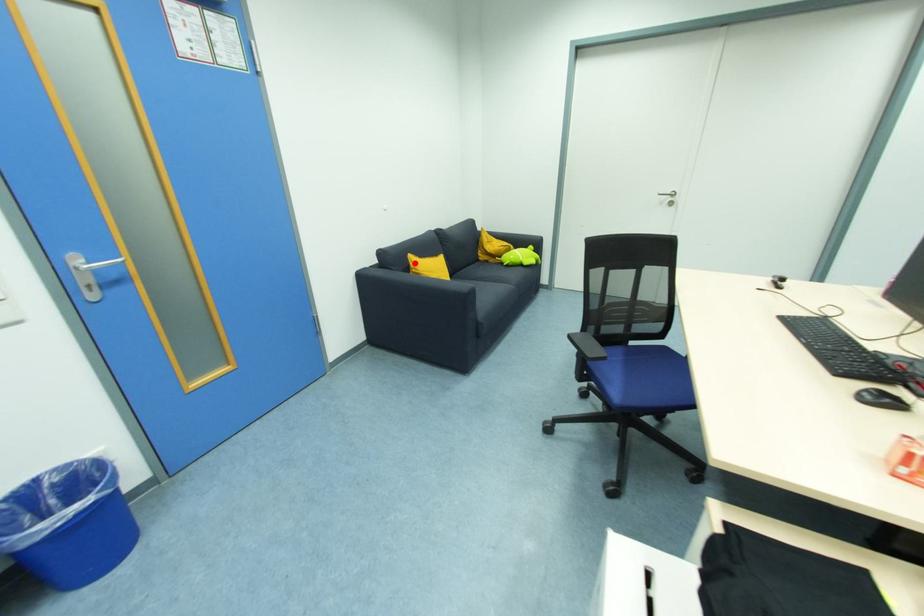
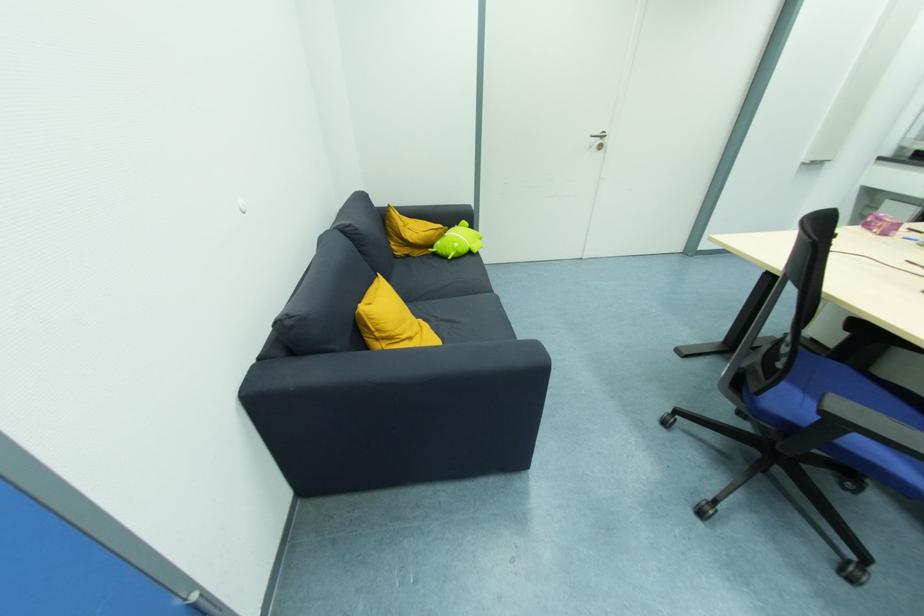
Locate, in the second image, the point that corresponds to the highlighted location in the first image.

(372, 321)